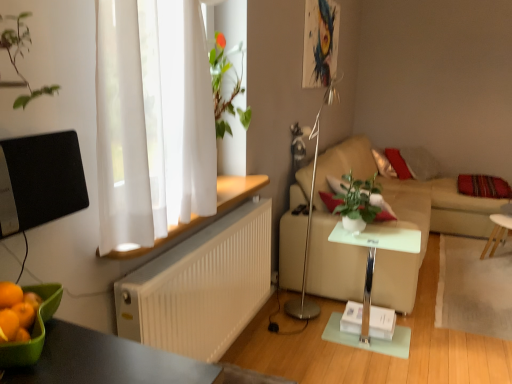
This screenshot has height=384, width=512. I want to click on vacant area that is situated to the right of green glossy houseplant at center, so click(x=398, y=233).